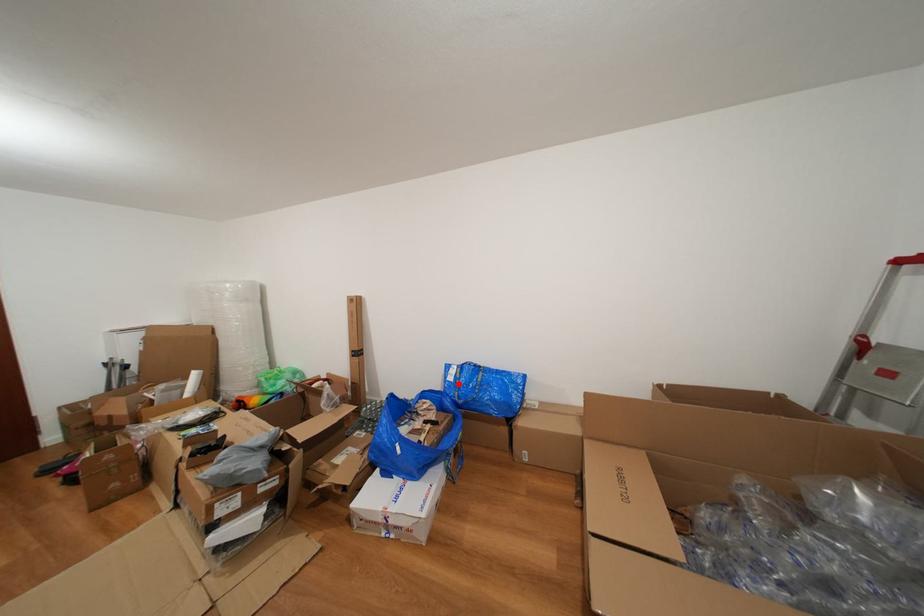
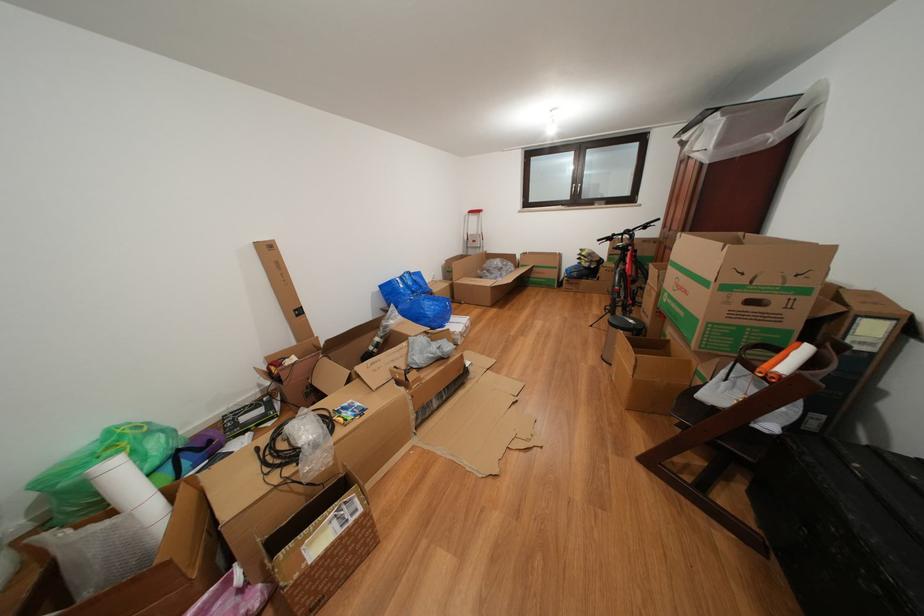
Find the pixel in the second image that matches the highlighted location in the first image.

(409, 291)